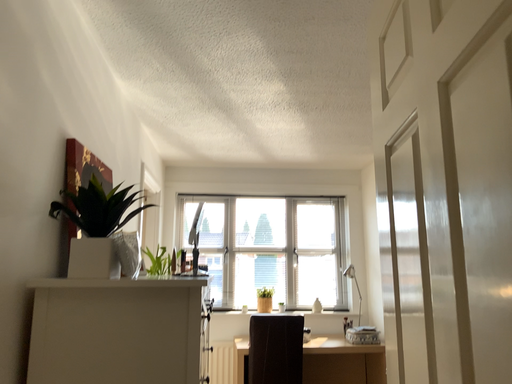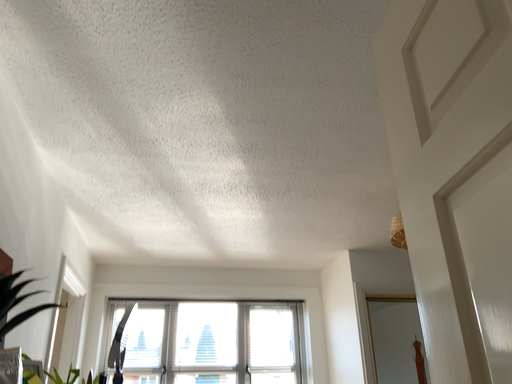
Question: Which way did the camera rotate in the video?

Choices:
 (A) rotated downward
 (B) rotated upward

Answer: (B)